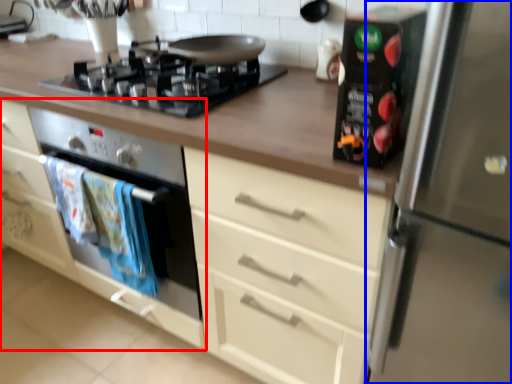
Question: Among these objects, which one is farthest to the camera, cabinetry (highlighted by a red box) or refrigerator (highlighted by a blue box)?

Choices:
 (A) cabinetry
 (B) refrigerator

Answer: (A)